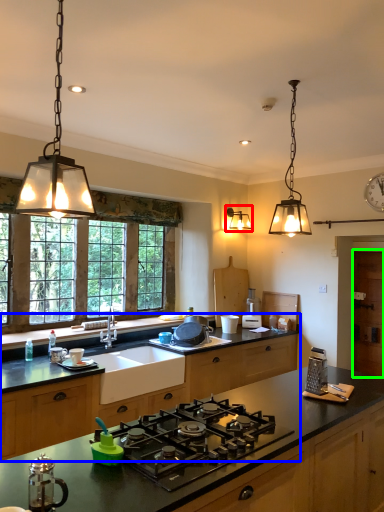
Question: Which object is the closest to the light fixture (highlighted by a red box)? Choose among these: cabinetry (highlighted by a blue box) or cabinetry (highlighted by a green box).

Choices:
 (A) cabinetry
 (B) cabinetry

Answer: (B)